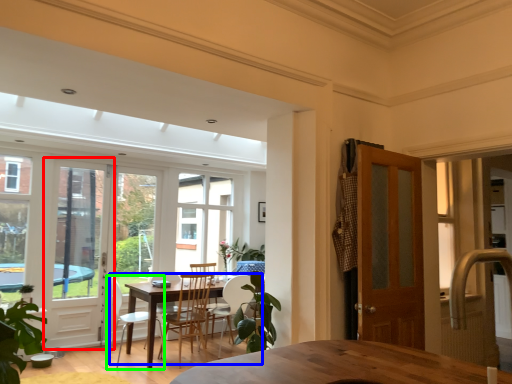
Question: Which object is positioned closest to screen door (highlighted by a red box)? Select from kitchen & dining room table (highlighted by a blue box) and chair (highlighted by a green box).

Choices:
 (A) kitchen & dining room table
 (B) chair

Answer: (B)